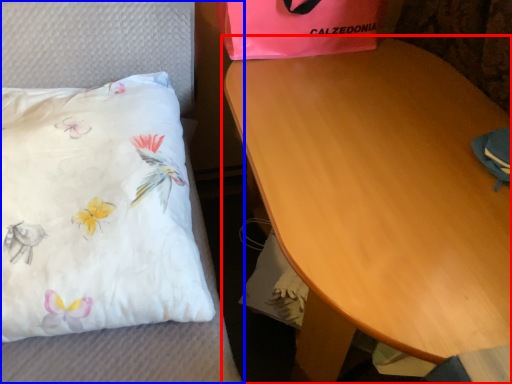
Question: Which object appears farthest to the camera in this image, table (highlighted by a red box) or furniture (highlighted by a blue box)?

Choices:
 (A) table
 (B) furniture

Answer: (B)